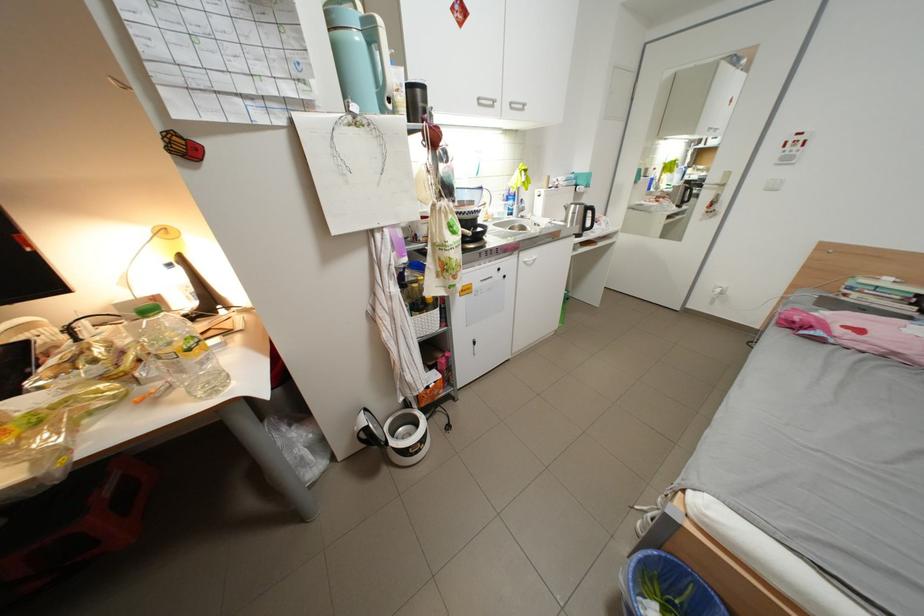
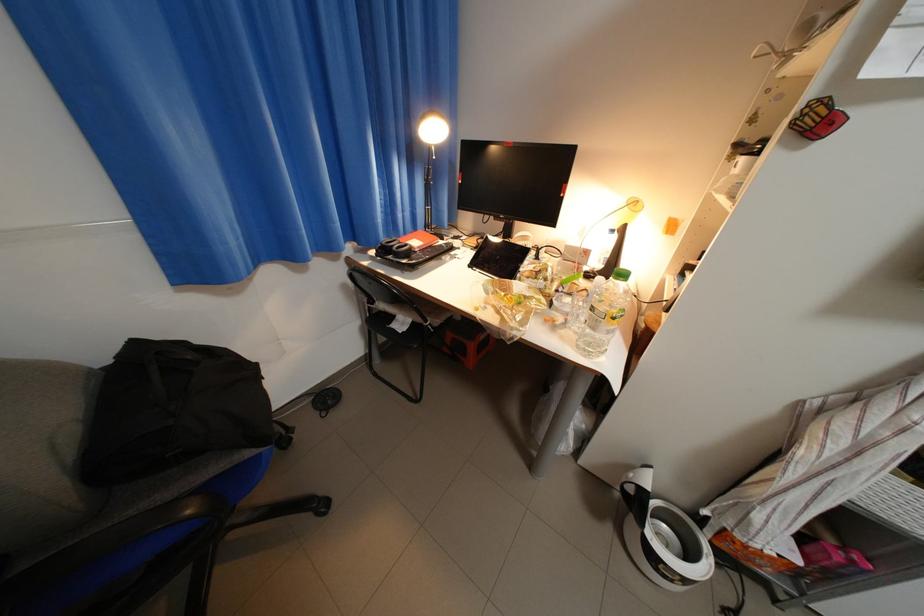
Where in the second image is the point corresponding to point 193,373 from the first image?

(605, 330)